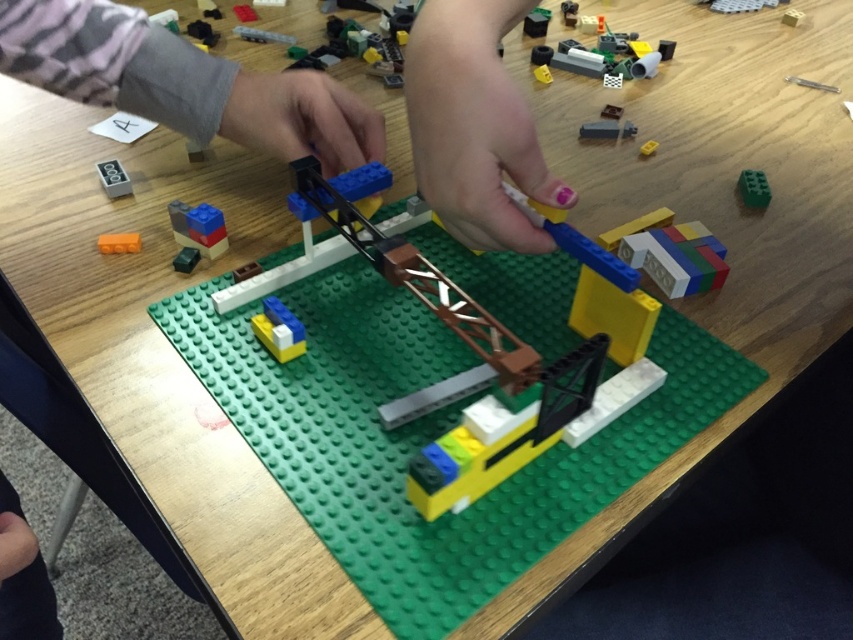
Is yellow matte brick at center closer to camera compared to orange matte block at lower left?

Yes, yellow matte brick at center is in front of orange matte block at lower left.

This screenshot has height=640, width=853. Describe the element at coordinates (277, 330) in the screenshot. I see `yellow matte brick at center` at that location.

Measure the distance between point (260, 339) and camera.

The distance of point (260, 339) from camera is 56.12 centimeters.

Image resolution: width=853 pixels, height=640 pixels. What are the coordinates of `yellow matte brick at center` in the screenshot? It's located at (277, 330).

Can you confirm if yellow matte brick at center is wider than matte black sign at upper left?

No, yellow matte brick at center is not wider than matte black sign at upper left.

Who is more distant from viewer, (283, 332) or (111, 192)?

Point (111, 192)

The height and width of the screenshot is (640, 853). Find the location of `yellow matte brick at center`. yellow matte brick at center is located at coordinates (277, 330).

Between point (471, 156) and point (595, 129), which one is positioned behind?

The point (595, 129) is more distant.

Is pink acrylic nail at upper center positioned in front of matte black rectangular block at upper center?

Yes, pink acrylic nail at upper center is in front of matte black rectangular block at upper center.

Identify the location of pink acrylic nail at upper center. (474, 125).

Locate an element on the screen. The height and width of the screenshot is (640, 853). pink acrylic nail at upper center is located at coordinates (474, 125).